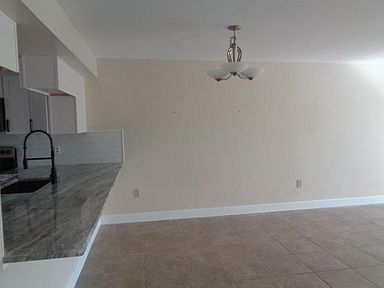
You are a GUI agent. You are given a task and a screenshot of the screen. Output one action in this format:
    pyautogui.click(x=<x>, y=<y>)
    Task: Click on the sink
    
    Given the screenshot: What is the action you would take?
    pyautogui.click(x=27, y=181)